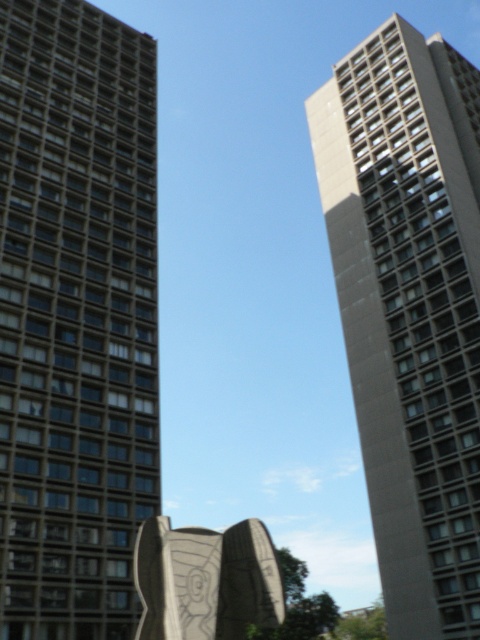
Which is in front, point (96, 152) or point (409, 604)?

Point (409, 604) is in front.

Is point (81, 54) in front of point (456, 342)?

No, it is not.

Who is more distant from viewer, (63, 77) or (406, 579)?

Point (63, 77)

Image resolution: width=480 pixels, height=640 pixels. Find the location of `matte gray building at left`. matte gray building at left is located at coordinates (75, 317).